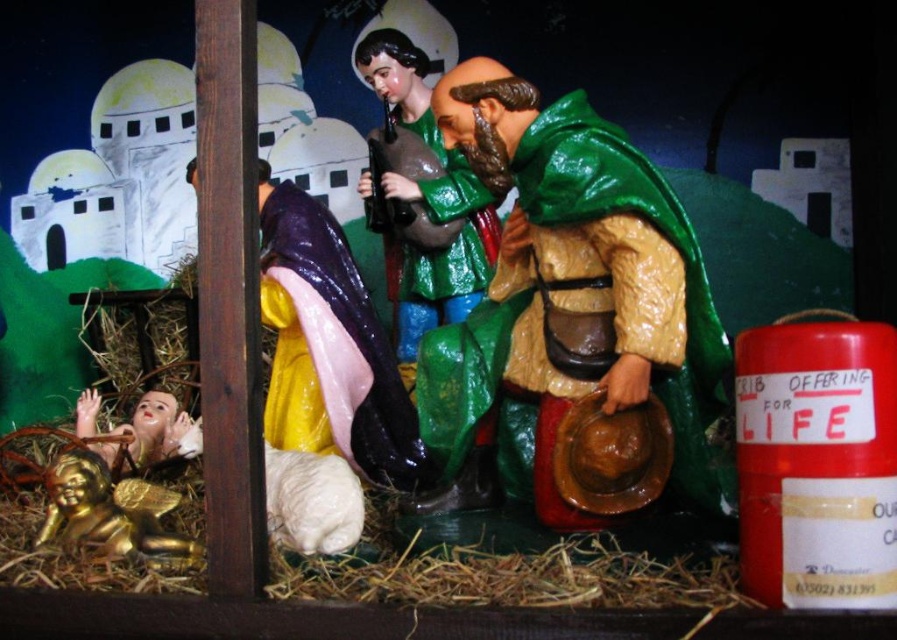
Can you confirm if purple glossy fabric at center is thinner than gold shiny angel at lower left?

No.

Does purple glossy fabric at center have a greater width compared to gold shiny angel at lower left?

Indeed, purple glossy fabric at center has a greater width compared to gold shiny angel at lower left.

Who is more distant from viewer, (405,472) or (118,504)?

The point (405,472) is behind.

Where is `purple glossy fabric at center`? Image resolution: width=897 pixels, height=640 pixels. purple glossy fabric at center is located at coordinates (329, 348).

Can you confirm if green glossy figure at center is positioned to the left of purple glossy fabric at center?

In fact, green glossy figure at center is to the right of purple glossy fabric at center.

Between green glossy figure at center and purple glossy fabric at center, which one appears on the left side from the viewer's perspective?

Positioned to the left is purple glossy fabric at center.

Measure the distance between point (563,524) and camera.

Point (563,524) and camera are 38.42 inches apart.

Identify the location of green glossy figure at center. (568, 305).

Between point (366, 186) and point (124, 556), which one is positioned behind?

The point (366, 186) is behind.

Which is more to the left, matte green figurine at center or gold shiny angel at lower left?

Positioned to the left is gold shiny angel at lower left.

I want to click on matte green figurine at center, so click(x=428, y=200).

The height and width of the screenshot is (640, 897). What are the coordinates of `matte green figurine at center` in the screenshot? It's located at (428, 200).